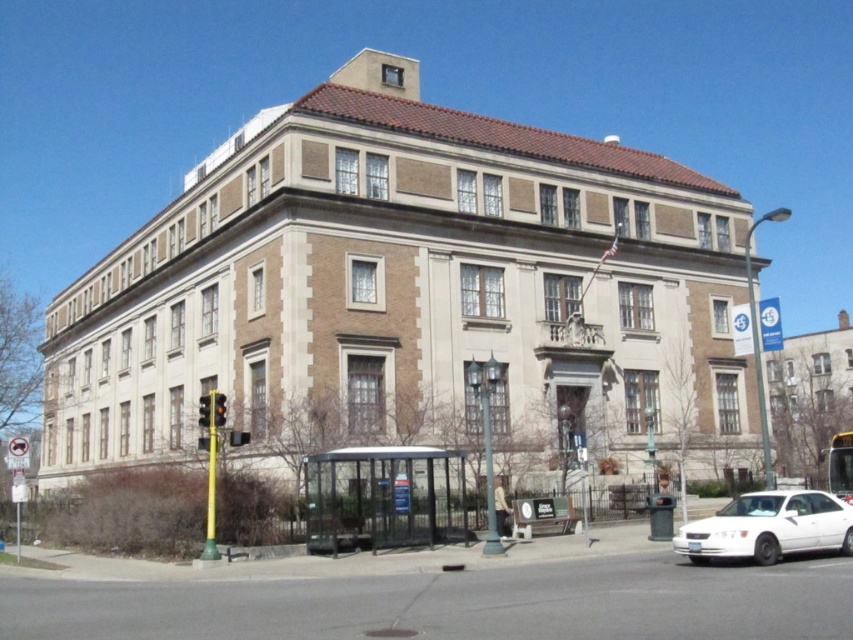
Question: From the image, what is the correct spatial relationship of metallic silver bus at center in relation to metallic traffic light at lower left?

Choices:
 (A) left
 (B) right

Answer: (B)

Question: Where is metallic silver bus at center located in relation to amber glass traffic light at center in the image?

Choices:
 (A) right
 (B) left

Answer: (A)

Question: Among these points, which one is nearest to the camera?

Choices:
 (A) (531, 536)
 (B) (764, 529)

Answer: (B)

Question: Estimate the real-world distances between objects in this image. Which object is farther from the white glossy sedan at lower right?

Choices:
 (A) metallic traffic light at lower left
 (B) clear glass bus stop at lower center
 (C) metallic silver bus at center
 (D) amber glass traffic light at center

Answer: (D)

Question: Is clear glass bus stop at lower center closer to the viewer compared to white glossy sedan at lower right?

Choices:
 (A) yes
 (B) no

Answer: (B)

Question: Which of the following is the farthest from the observer?

Choices:
 (A) (838, 451)
 (B) (759, 544)

Answer: (A)